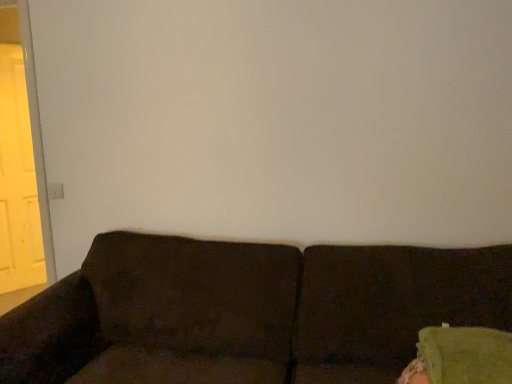
This screenshot has width=512, height=384. Identify the location of yellow matte door at left. (18, 181).

Measure the distance between yellow matte door at left and camera.

They are 2.14 meters apart.

What do you see at coordinates (18, 181) in the screenshot? I see `yellow matte door at left` at bounding box center [18, 181].

What do you see at coordinates (247, 312) in the screenshot? I see `dark brown fabric couch at lower center` at bounding box center [247, 312].

Where is `dark brown fabric couch at lower center`? dark brown fabric couch at lower center is located at coordinates (247, 312).

Where is `yellow matte door at left`? yellow matte door at left is located at coordinates (18, 181).

Which object is positioned more to the right, dark brown fabric couch at lower center or yellow matte door at left?

dark brown fabric couch at lower center.

Which is behind, dark brown fabric couch at lower center or yellow matte door at left?

Positioned behind is yellow matte door at left.

Which is nearer, (137, 380) or (0, 251)?

Point (137, 380)

From the image's perspective, would you say dark brown fabric couch at lower center is positioned over yellow matte door at left?

Actually, dark brown fabric couch at lower center appears below yellow matte door at left in the image.

Based on the photo, from a real-world perspective, which is physically below, dark brown fabric couch at lower center or yellow matte door at left?

dark brown fabric couch at lower center.

Looking at their sizes, would you say dark brown fabric couch at lower center is wider or thinner than yellow matte door at left?

In the image, dark brown fabric couch at lower center appears to be wider than yellow matte door at left.

Considering the relative sizes of dark brown fabric couch at lower center and yellow matte door at left in the image provided, is dark brown fabric couch at lower center taller than yellow matte door at left?

Incorrect, the height of dark brown fabric couch at lower center is not larger of that of yellow matte door at left.

Considering the sizes of objects dark brown fabric couch at lower center and yellow matte door at left in the image provided, who is smaller, dark brown fabric couch at lower center or yellow matte door at left?

yellow matte door at left.

Is dark brown fabric couch at lower center completely or partially outside of yellow matte door at left?

Answer: dark brown fabric couch at lower center is positioned outside yellow matte door at left.

In the scene shown: Are dark brown fabric couch at lower center and yellow matte door at left beside each other?

No, dark brown fabric couch at lower center is not in contact with yellow matte door at left.

Is dark brown fabric couch at lower center facing towards yellow matte door at left?

No, dark brown fabric couch at lower center does not turn towards yellow matte door at left.

The height and width of the screenshot is (384, 512). In order to click on screen door above the dark brown fabric couch at lower center (from the image's perspective) in this screenshot , I will do `click(18, 181)`.

Can you confirm if yellow matte door at left is positioned to the right of dark brown fabric couch at lower center?

No.

Relative to dark brown fabric couch at lower center, is yellow matte door at left in front or behind?

yellow matte door at left is behind dark brown fabric couch at lower center.

Between point (34, 257) and point (259, 377), which one is positioned behind?

Point (34, 257)

From the image's perspective, which one is positioned lower, yellow matte door at left or dark brown fabric couch at lower center?

dark brown fabric couch at lower center.

From a real-world perspective, does yellow matte door at left sit lower than dark brown fabric couch at lower center?

No, from a real-world perspective, yellow matte door at left is not under dark brown fabric couch at lower center.

Does yellow matte door at left have a greater width compared to dark brown fabric couch at lower center?

No, yellow matte door at left is not wider than dark brown fabric couch at lower center.

Who is taller, yellow matte door at left or dark brown fabric couch at lower center?

Standing taller between the two is yellow matte door at left.

Can you confirm if yellow matte door at left is smaller than dark brown fabric couch at lower center?

Indeed, yellow matte door at left has a smaller size compared to dark brown fabric couch at lower center.

Can we say yellow matte door at left lies outside dark brown fabric couch at lower center?

Yes, yellow matte door at left is outside of dark brown fabric couch at lower center.

Are yellow matte door at left and dark brown fabric couch at lower center located far from each other?

yellow matte door at left is far away from dark brown fabric couch at lower center.

Is yellow matte door at left facing towards dark brown fabric couch at lower center?

Yes, yellow matte door at left faces towards dark brown fabric couch at lower center.

Where is `studio couch lying in front of the yellow matte door at left`? studio couch lying in front of the yellow matte door at left is located at coordinates point(247,312).

Find the location of a particular element. screen door that is above the dark brown fabric couch at lower center (from the image's perspective) is located at coordinates (18, 181).

Locate an element on the screen. Image resolution: width=512 pixels, height=384 pixels. studio couch in front of the yellow matte door at left is located at coordinates (247, 312).